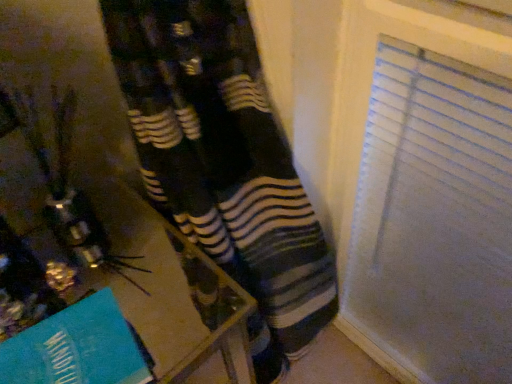
What do you see at coordinates (76, 348) in the screenshot? I see `teal paper at lower left` at bounding box center [76, 348].

You are a GUI agent. You are given a task and a screenshot of the screen. Output one action in this format:
    pyautogui.click(x=<x>, y=<y>)
    Task: Click on the teal paper at lower left
    
    Given the screenshot: What is the action you would take?
    pyautogui.click(x=76, y=348)

At what (x,y) coordinates should I click in order to perform the action: click on wooden table at lower left. Please return your answer as a coordinate pair (x, y). The height and width of the screenshot is (384, 512). Looking at the image, I should click on (116, 301).

Describe the element at coordinates (116, 301) in the screenshot. This screenshot has width=512, height=384. I see `wooden table at lower left` at that location.

In the scene shown: Measure the distance between wooden table at lower left and camera.

A distance of 19.13 inches exists between wooden table at lower left and camera.

This screenshot has width=512, height=384. In order to click on teal paper at lower left in this screenshot , I will do `click(76, 348)`.

Considering the relative positions of wooden table at lower left and teal paper at lower left in the image provided, is wooden table at lower left to the left or to the right of teal paper at lower left?

wooden table at lower left is to the right of teal paper at lower left.

Is wooden table at lower left further to camera compared to teal paper at lower left?

Yes, the depth of wooden table at lower left is greater than that of teal paper at lower left.

Between point (158, 351) and point (106, 378), which one is positioned behind?

Point (158, 351)

From the image's perspective, is wooden table at lower left above or below teal paper at lower left?

Based on their image positions, wooden table at lower left is located beneath teal paper at lower left.

From a real-world perspective, is wooden table at lower left physically above teal paper at lower left?

Actually, wooden table at lower left is physically below teal paper at lower left in the real world.

Is wooden table at lower left wider or thinner than teal paper at lower left?

Clearly, wooden table at lower left has more width compared to teal paper at lower left.

Can you confirm if wooden table at lower left is shorter than teal paper at lower left?

No, wooden table at lower left is not shorter than teal paper at lower left.

Which of these two, wooden table at lower left or teal paper at lower left, is bigger?

With larger size is wooden table at lower left.

From the picture: Could teal paper at lower left be considered to be inside wooden table at lower left?

No, teal paper at lower left is not surrounded by wooden table at lower left.

Are wooden table at lower left and teal paper at lower left located far from each other?

They are positioned close to each other.

Based on the photo, is wooden table at lower left turned away from teal paper at lower left?

No, wooden table at lower left is not facing the opposite direction of teal paper at lower left.

This screenshot has width=512, height=384. I want to click on paperback book lying on the left of wooden table at lower left, so click(x=76, y=348).

Between teal paper at lower left and wooden table at lower left, which one appears on the left side from the viewer's perspective?

Positioned to the left is teal paper at lower left.

Is teal paper at lower left in front of wooden table at lower left?

Yes, it is in front of wooden table at lower left.

Which point is more forward, (82,371) or (27,215)?

The point (82,371) is in front.

From the image's perspective, between teal paper at lower left and wooden table at lower left, who is located below?

wooden table at lower left is shown below in the image.

From a real-world perspective, is teal paper at lower left physically above wooden table at lower left?

Yes, from a real-world perspective, teal paper at lower left is over wooden table at lower left

In terms of width, does teal paper at lower left look wider or thinner when compared to wooden table at lower left?

Considering their sizes, teal paper at lower left looks slimmer than wooden table at lower left.

Which of these two, teal paper at lower left or wooden table at lower left, stands shorter?

teal paper at lower left is shorter.

Does teal paper at lower left have a larger size compared to wooden table at lower left?

Actually, teal paper at lower left might be smaller than wooden table at lower left.

Is wooden table at lower left a part of teal paper at lower left?

No, wooden table at lower left is not a part of teal paper at lower left.

Is teal paper at lower left far from wooden table at lower left?

That's not correct — teal paper at lower left is a little close to wooden table at lower left.

Is teal paper at lower left facing towards wooden table at lower left?

No, teal paper at lower left is not aimed at wooden table at lower left.

How many degrees apart are the facing directions of teal paper at lower left and wooden table at lower left?

teal paper at lower left and wooden table at lower left are facing 5.1 degrees away from each other.

Where is `table on the right of teal paper at lower left`? table on the right of teal paper at lower left is located at coordinates (116, 301).

This screenshot has height=384, width=512. In the image, there is a wooden table at lower left. Find the location of `paperback book above it (from the image's perspective)`. paperback book above it (from the image's perspective) is located at coordinates (76, 348).

There is a wooden table at lower left. Where is `paperback book above it (from a real-world perspective)`? paperback book above it (from a real-world perspective) is located at coordinates (76, 348).